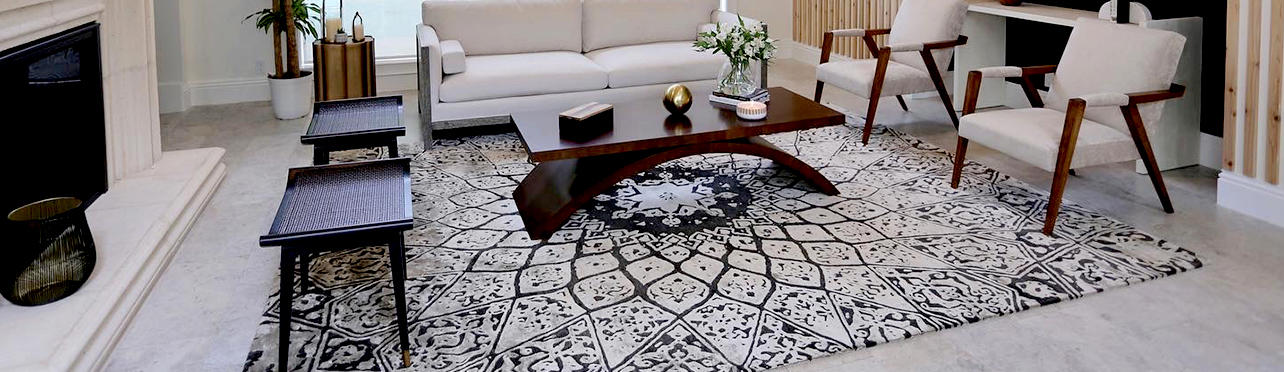
You are a GUI agent. You are given a task and a screenshot of the screen. Output one action in this format:
    pyautogui.click(x=<x>, y=<y>)
    Task: Click on the rightmost chair
    This screenshot has height=372, width=1284.
    Given the screenshot: What is the action you would take?
    pyautogui.click(x=1098, y=73)